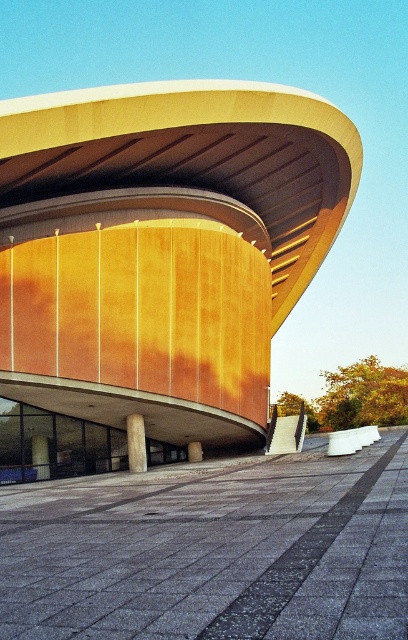
Does smooth concrete pillar at center come behind wooden pillar at center?

That is False.

Is point (46, 460) in front of point (197, 456)?

Yes, it is.

Image resolution: width=408 pixels, height=640 pixels. What are the coordinates of `smooth concrete pillar at center` in the screenshot? It's located at (39, 456).

Can you confirm if smooth wood pillar at center is smaller than wooden pillar at center?

No.

Is smooth wood pillar at center further to camera compared to wooden pillar at center?

No.

Is point (137, 460) more distant than point (197, 456)?

No.

Locate an element on the screen. The width and height of the screenshot is (408, 640). smooth wood pillar at center is located at coordinates (135, 442).

Does smooth wood pillar at center have a greater width compared to smooth concrete pillar at center?

Yes.

Between smooth wood pillar at center and smooth concrete pillar at center, which one is positioned lower?

smooth concrete pillar at center

Is point (144, 465) farther from camera compared to point (40, 456)?

That is True.

This screenshot has width=408, height=640. I want to click on smooth wood pillar at center, so click(135, 442).